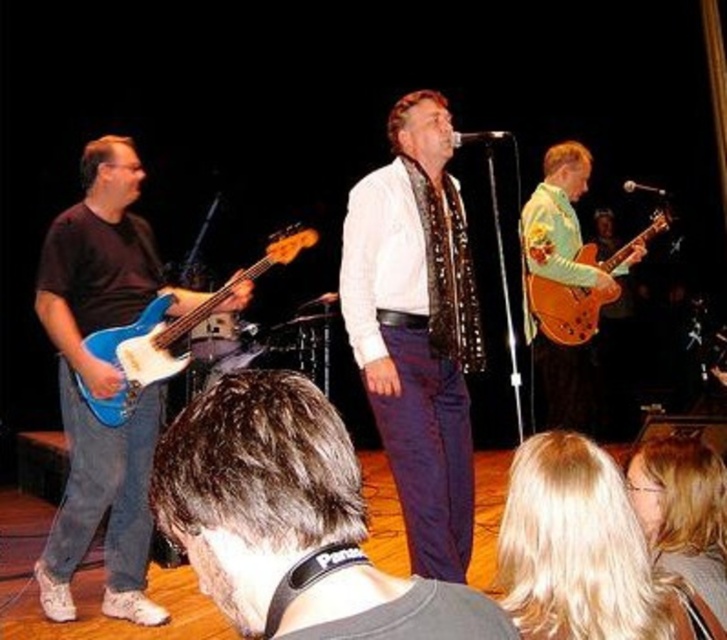
Question: Can you confirm if white textured shirt at center is positioned above blonde hair at upper center?

Choices:
 (A) yes
 (B) no

Answer: (A)

Question: Is dark brown hair at center above blonde hair at upper center?

Choices:
 (A) no
 (B) yes

Answer: (B)

Question: Which is nearer to the blonde hair at upper center?

Choices:
 (A) glossy wood guitar at right
 (B) matte blue electric guitar at left
 (C) blonde hair at lower right

Answer: (C)

Question: Among these points, which one is nearest to the camera?

Choices:
 (A) (190, 442)
 (B) (534, 445)

Answer: (A)

Question: Is white textured shirt at center further to the viewer compared to blue matte electric guitar at left?

Choices:
 (A) yes
 (B) no

Answer: (B)

Question: Which point is closer to the camera taking this photo?

Choices:
 (A) (305, 230)
 (B) (678, 480)
 (C) (124, 243)
 (D) (427, 168)

Answer: (B)